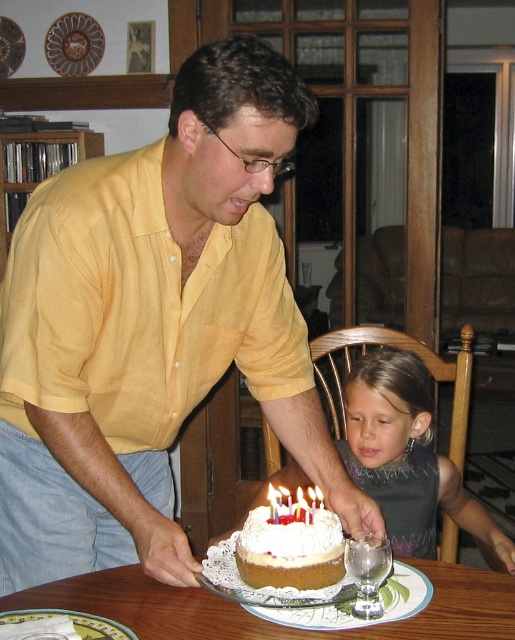
Does point (95, 166) come farther from viewer compared to point (468, 584)?

No.

Is yellow cotton shirt at center below wooden table at center?

No, yellow cotton shirt at center is not below wooden table at center.

Is point (204, 253) closer to camera compared to point (125, 611)?

No, it is behind (125, 611).

Identify the location of yellow cotton shirt at center. The height and width of the screenshot is (640, 515). (153, 326).

Between smooth gray dress at center and white frosted cake at center, which one is positioned lower?

smooth gray dress at center is lower down.

Who is higher up, smooth gray dress at center or white frosted cake at center?

white frosted cake at center is higher up.

Where is `smooth gray dress at center`? This screenshot has width=515, height=640. smooth gray dress at center is located at coordinates (406, 456).

The image size is (515, 640). Find the location of `smooth gray dress at center`. smooth gray dress at center is located at coordinates (406, 456).

Between white frosted cake at center and white wax candle at center, which one appears on the left side from the viewer's perspective?

Positioned to the left is white frosted cake at center.

Can you confirm if white frosted cake at center is bigger than white wax candle at center?

Correct, white frosted cake at center is larger in size than white wax candle at center.

Where is `white frosted cake at center`? The image size is (515, 640). white frosted cake at center is located at coordinates (290, 550).